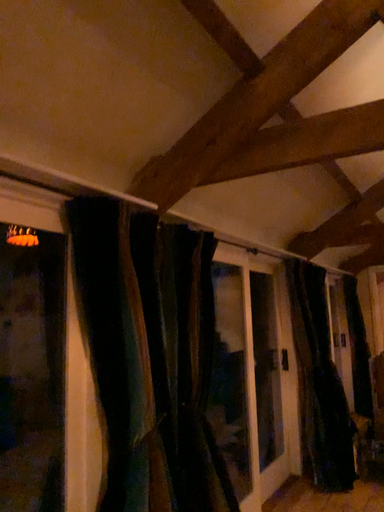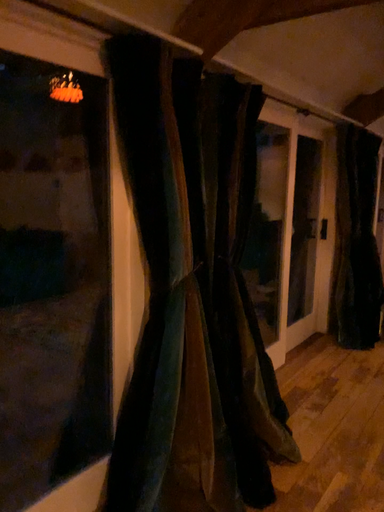
Question: Which way did the camera rotate in the video?

Choices:
 (A) rotated upward
 (B) rotated downward

Answer: (B)